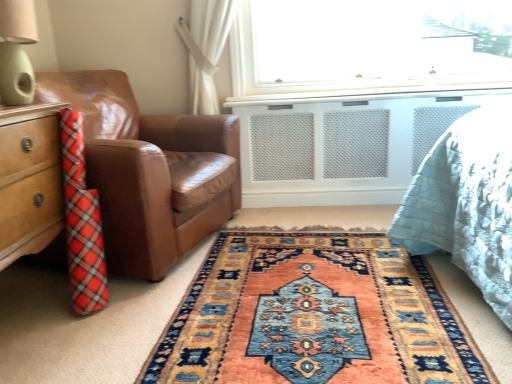
Question: Is brown leather chair at left positioned before matte green lampshade at upper left?

Choices:
 (A) no
 (B) yes

Answer: (A)

Question: Considering the relative positions of brown leather chair at left and matte green lampshade at upper left in the image provided, is brown leather chair at left behind matte green lampshade at upper left?

Choices:
 (A) yes
 (B) no

Answer: (A)

Question: Could you tell me if brown leather chair at left is turned towards matte green lampshade at upper left?

Choices:
 (A) no
 (B) yes

Answer: (A)

Question: Would you say brown leather chair at left is outside matte green lampshade at upper left?

Choices:
 (A) no
 (B) yes

Answer: (B)

Question: Is matte green lampshade at upper left at the back of brown leather chair at left?

Choices:
 (A) no
 (B) yes

Answer: (A)

Question: Based on their sizes in the image, would you say carpet with intricate patterns at center is bigger or smaller than brown leather chair at left?

Choices:
 (A) big
 (B) small

Answer: (B)

Question: Is carpet with intricate patterns at center in front of or behind brown leather chair at left in the image?

Choices:
 (A) front
 (B) behind

Answer: (A)

Question: Considering the positions of point (327, 309) and point (137, 145), is point (327, 309) closer or farther from the camera than point (137, 145)?

Choices:
 (A) farther
 (B) closer

Answer: (B)

Question: Is carpet with intricate patterns at center taller or shorter than brown leather chair at left?

Choices:
 (A) tall
 (B) short

Answer: (B)

Question: Considering their positions, is matte green lampshade at upper left located in front of or behind carpet with intricate patterns at center?

Choices:
 (A) behind
 (B) front

Answer: (A)

Question: Would you say matte green lampshade at upper left is inside or outside carpet with intricate patterns at center?

Choices:
 (A) outside
 (B) inside

Answer: (A)

Question: Based on their sizes in the image, would you say matte green lampshade at upper left is bigger or smaller than carpet with intricate patterns at center?

Choices:
 (A) small
 (B) big

Answer: (A)

Question: Does point tap(24, 99) appear closer or farther from the camera than point tap(297, 380)?

Choices:
 (A) closer
 (B) farther

Answer: (B)

Question: Is brown leather chair at left wider or thinner than matte green lampshade at upper left?

Choices:
 (A) wide
 (B) thin

Answer: (A)

Question: Considering their positions, is brown leather chair at left located in front of or behind matte green lampshade at upper left?

Choices:
 (A) front
 (B) behind

Answer: (B)